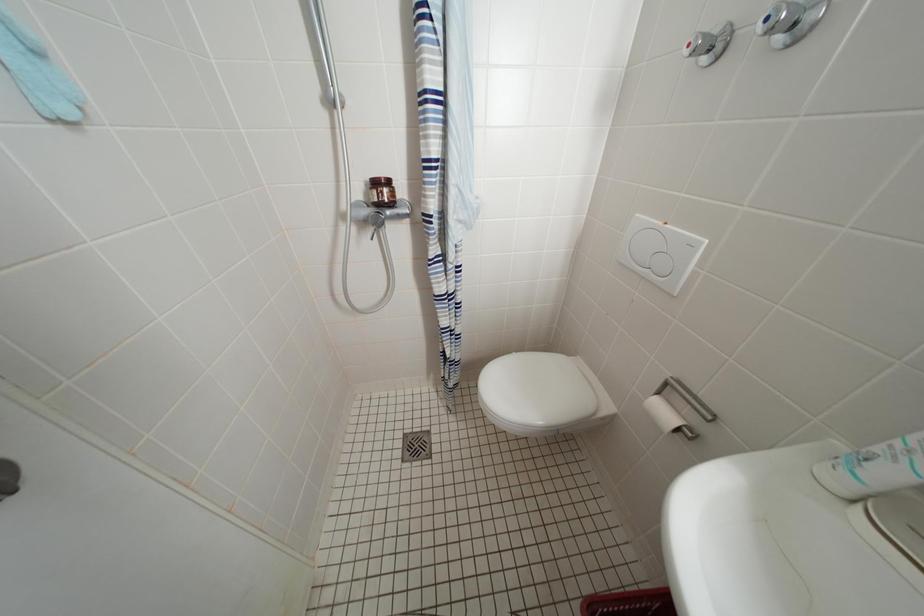
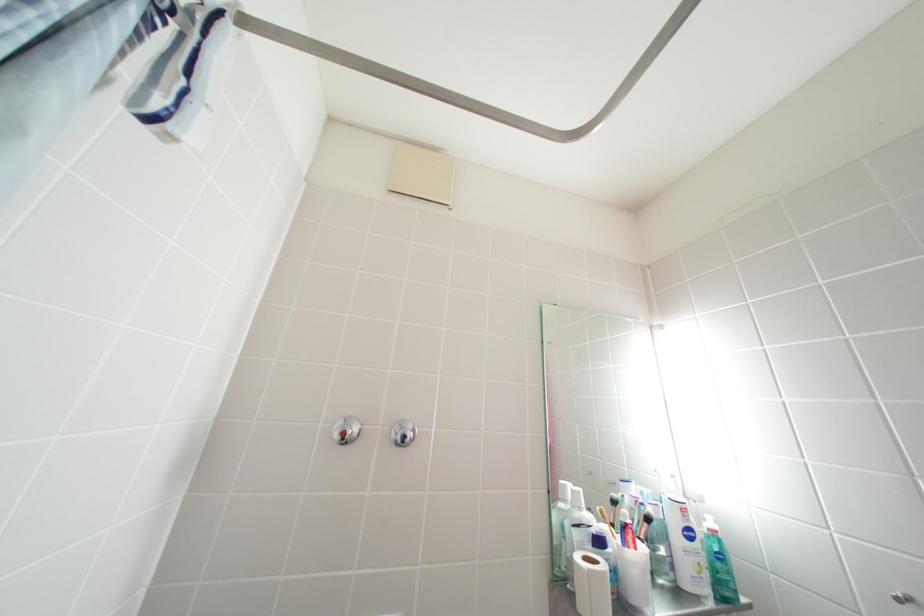
Question: The images are taken continuously from a first-person perspective. In which direction is your viewpoint rotating?

Choices:
 (A) Left
 (B) Right
 (C) Up
 (D) Down

Answer: (B)